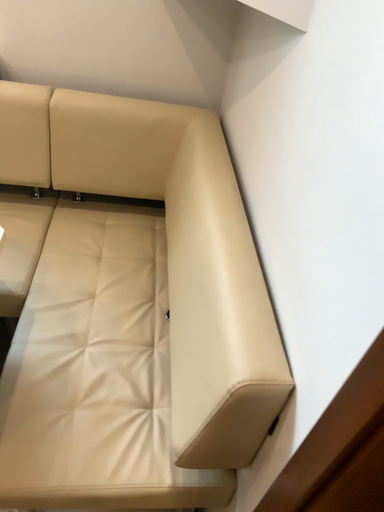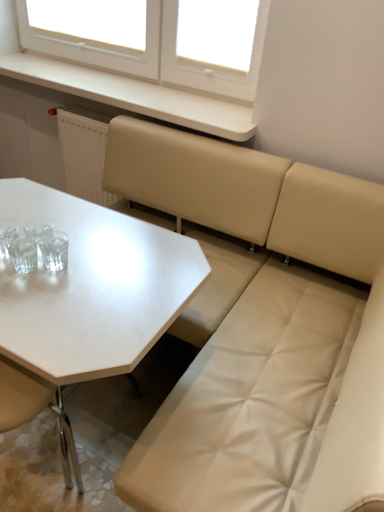
Question: Which way did the camera rotate in the video?

Choices:
 (A) rotated right
 (B) rotated left

Answer: (B)